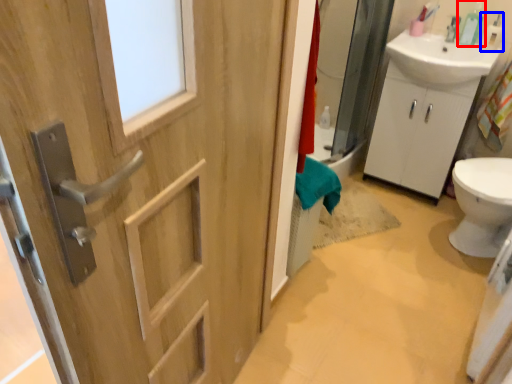
Question: Which of the following is the closest to the observer, soap dispenser (highlighted by a red box) or toiletry (highlighted by a blue box)?

Choices:
 (A) soap dispenser
 (B) toiletry

Answer: (B)